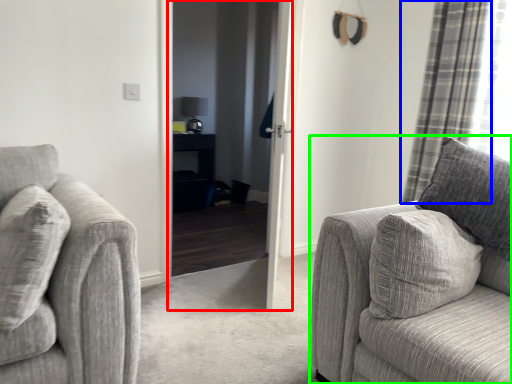
Question: Based on their relative distances, which object is nearer to screen door (highlighted by a red box)? Choose from curtain (highlighted by a blue box) and studio couch (highlighted by a green box).

Choices:
 (A) curtain
 (B) studio couch

Answer: (A)